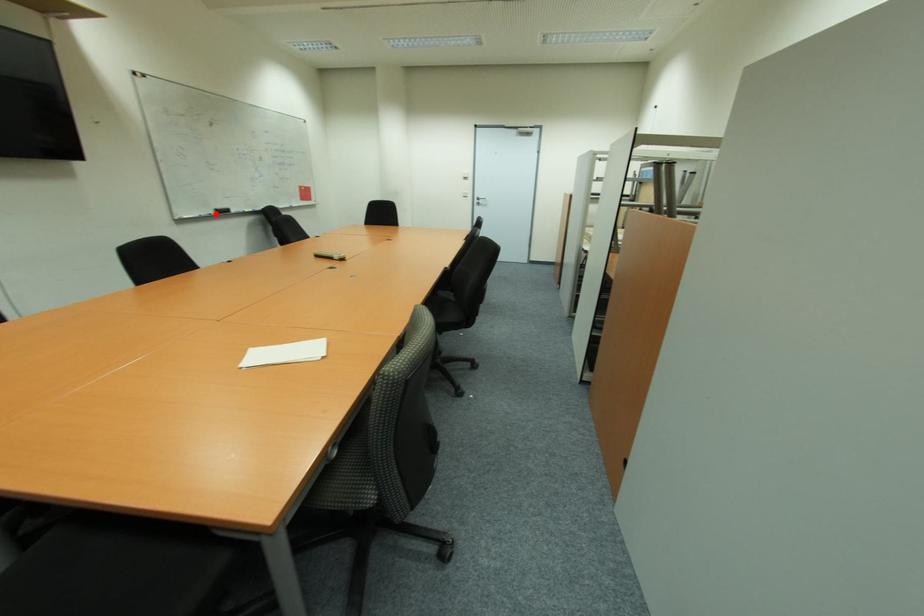
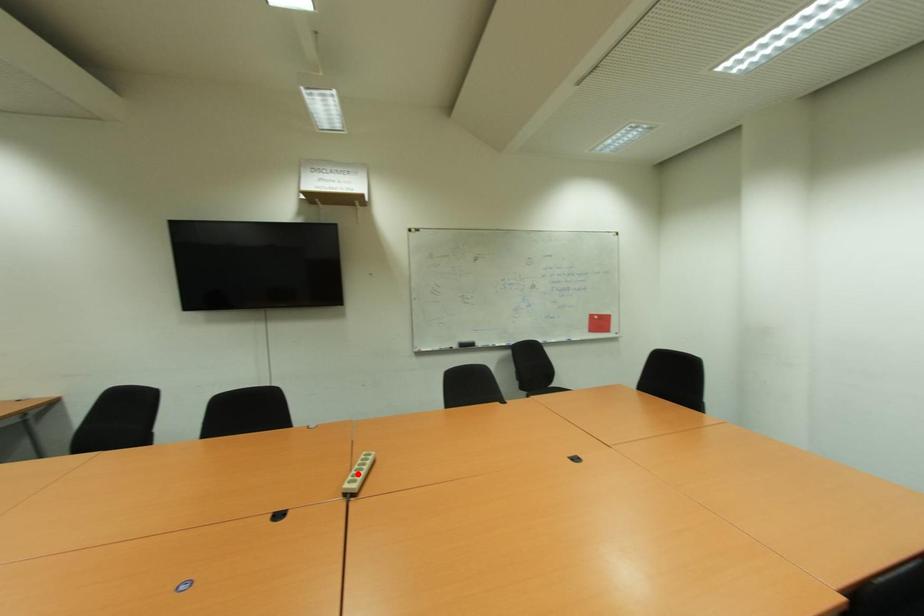
I am providing you with two images of the same scene from different viewpoints. A red point is marked on the first image and another point is marked on the second image. Are the points marked in image1 and image2 representing the same 3D position?

No